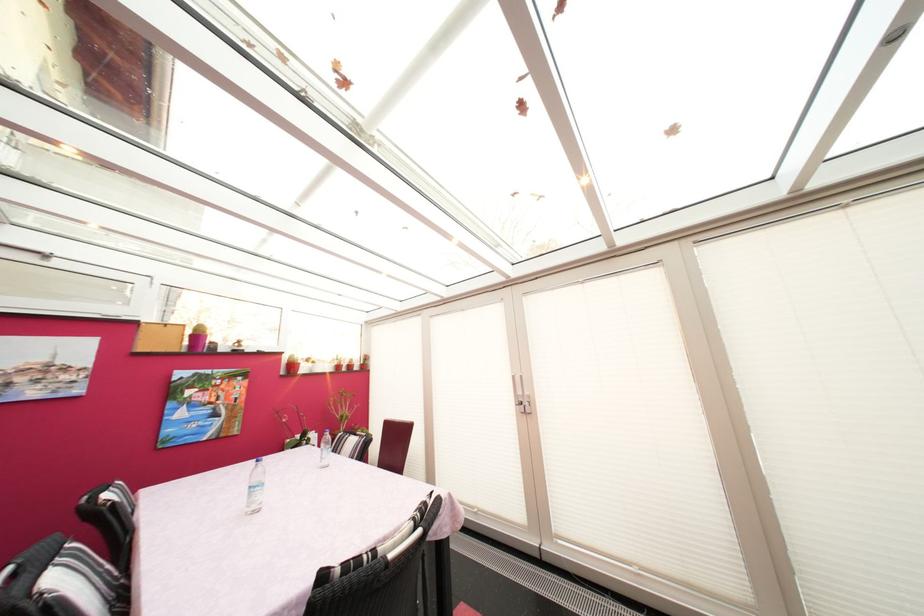
I want to click on pink potted plant, so click(337, 363).